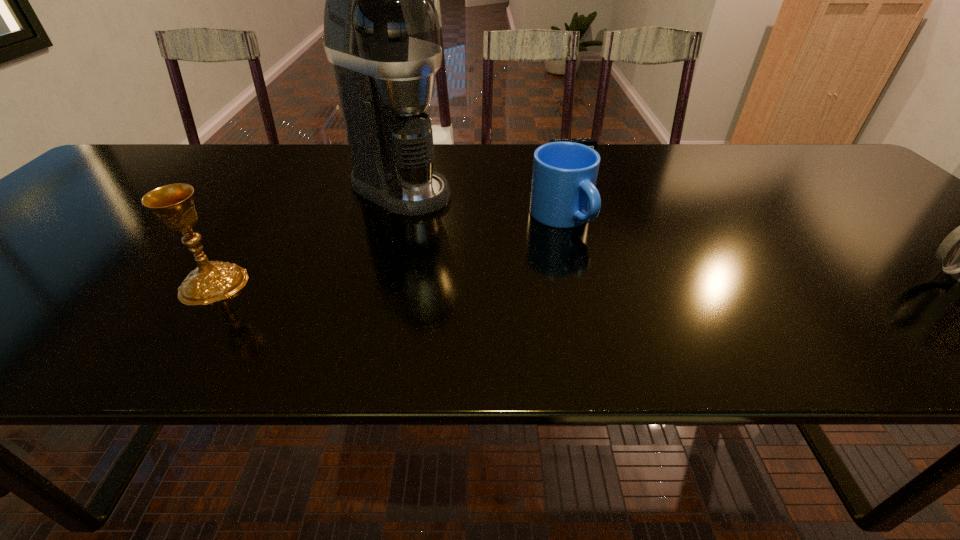
The height and width of the screenshot is (540, 960). What are the coordinates of `the leftmost object` in the screenshot? It's located at (211, 281).

Where is `chalice`? The image size is (960, 540). chalice is located at coordinates (211, 281).

What are the coordinates of `alarm clock` in the screenshot? It's located at (591, 142).

Where is `the farther mug`? Image resolution: width=960 pixels, height=540 pixels. the farther mug is located at coordinates (563, 195).

You are a GUI agent. You are given a task and a screenshot of the screen. Output one action in this format:
    pyautogui.click(x=<x>, y=<y>)
    Task: Click on the tallest object
    
    Given the screenshot: What is the action you would take?
    pyautogui.click(x=381, y=29)

Where is `coffee maker`? The image size is (960, 540). coffee maker is located at coordinates (381, 29).

At what (x,y) coordinates should I click in order to perform the action: click on free space located on the right of the fourth shortest object. Please return your answer as a coordinate pair (x, y). This screenshot has width=960, height=540. Looking at the image, I should click on (277, 284).

Locate an element on the screen. This screenshot has height=540, width=960. blank area located 0.080m on the front-facing side of the shortest object is located at coordinates (582, 179).

Locate an element on the screen. The image size is (960, 540). free space located on the front-facing side of the shortest object is located at coordinates (581, 177).

Identify the location of free space located 0.360m on the front-facing side of the shortest object. The width and height of the screenshot is (960, 540). (619, 241).